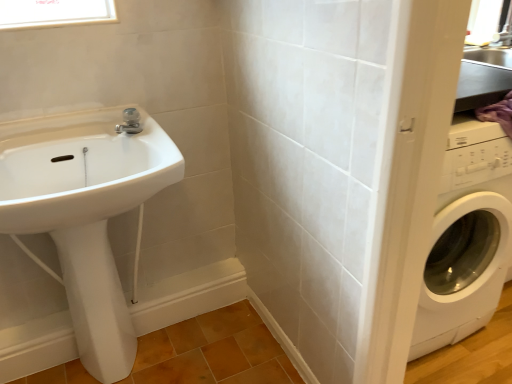
Question: Is the position of satin nickel faucet at upper center less distant than that of clear glass window at upper left?

Choices:
 (A) no
 (B) yes

Answer: (A)

Question: From the image's perspective, does satin nickel faucet at upper center appear lower than clear glass window at upper left?

Choices:
 (A) no
 (B) yes

Answer: (B)

Question: Can you confirm if satin nickel faucet at upper center is shorter than clear glass window at upper left?

Choices:
 (A) yes
 (B) no

Answer: (A)

Question: Does satin nickel faucet at upper center lie behind clear glass window at upper left?

Choices:
 (A) yes
 (B) no

Answer: (A)

Question: Is satin nickel faucet at upper center taller than clear glass window at upper left?

Choices:
 (A) yes
 (B) no

Answer: (B)

Question: Is satin nickel faucet at upper center completely or partially outside of clear glass window at upper left?

Choices:
 (A) yes
 (B) no

Answer: (A)

Question: From the image's perspective, is white glossy sink at left below clear glass window at upper left?

Choices:
 (A) no
 (B) yes

Answer: (B)

Question: Is white glossy sink at left to the left of clear glass window at upper left from the viewer's perspective?

Choices:
 (A) yes
 (B) no

Answer: (B)

Question: Is white glossy sink at left positioned before clear glass window at upper left?

Choices:
 (A) yes
 (B) no

Answer: (A)

Question: Is white glossy sink at left beside clear glass window at upper left?

Choices:
 (A) no
 (B) yes

Answer: (A)

Question: Is white glossy sink at left not within clear glass window at upper left?

Choices:
 (A) no
 (B) yes

Answer: (B)

Question: From a real-world perspective, is white glossy sink at left on clear glass window at upper left?

Choices:
 (A) yes
 (B) no

Answer: (B)

Question: Is satin nickel faucet at upper center completely or partially outside of white glossy bidet at lower left?

Choices:
 (A) yes
 (B) no

Answer: (A)